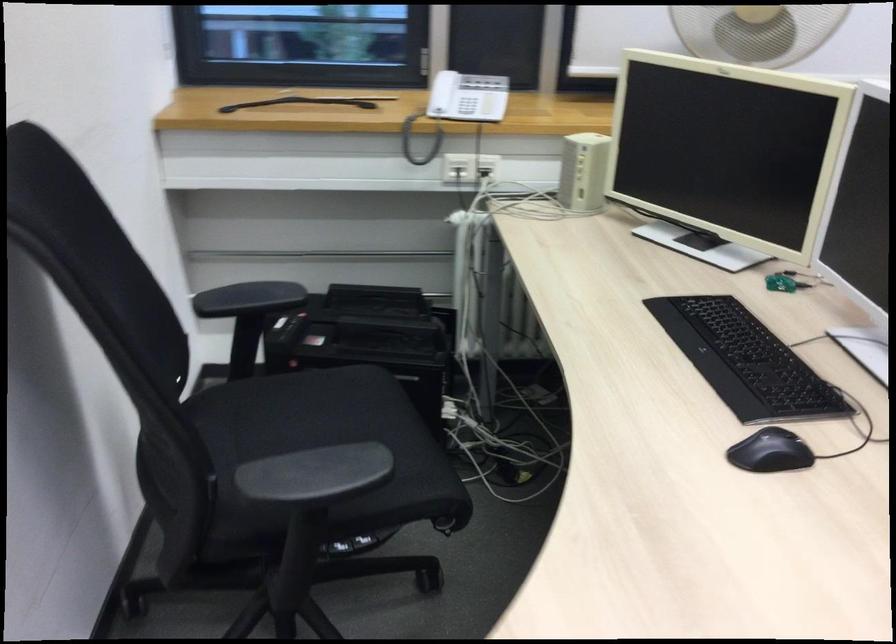
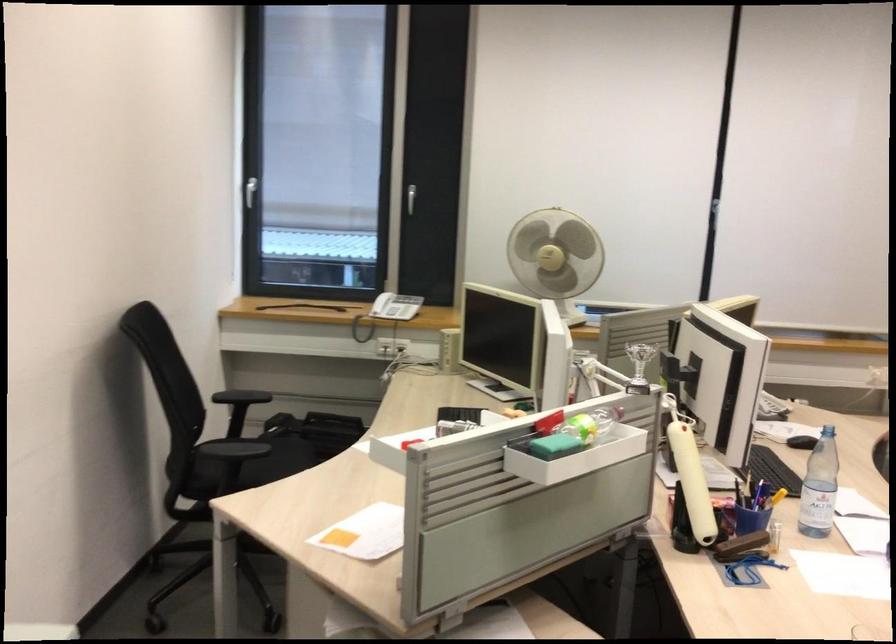
Locate, in the second image, the point that corresponds to point 374,398 in the first image.

(293, 453)